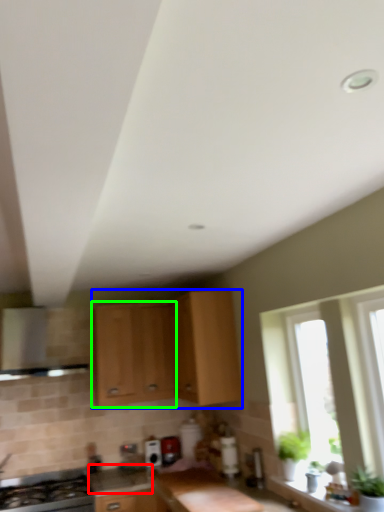
Question: Which object is positioned closest to counter top (highlighted by a red box)? Select from cabinetry (highlighted by a blue box) and cabinetry (highlighted by a green box).

Choices:
 (A) cabinetry
 (B) cabinetry

Answer: (A)